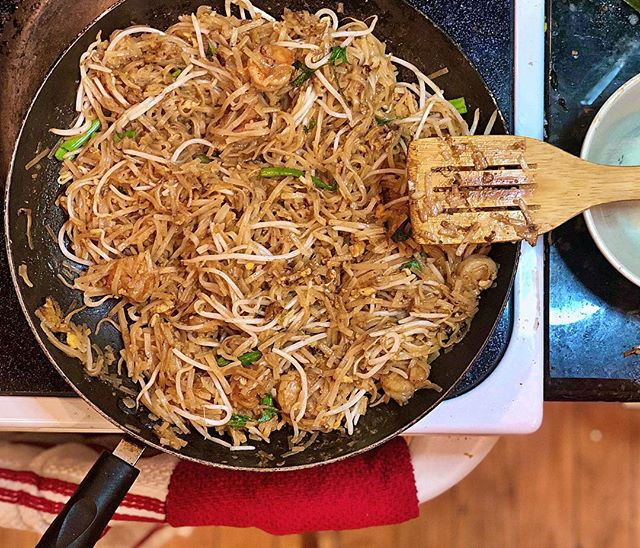
Where is `stove top`? stove top is located at coordinates (512, 399).